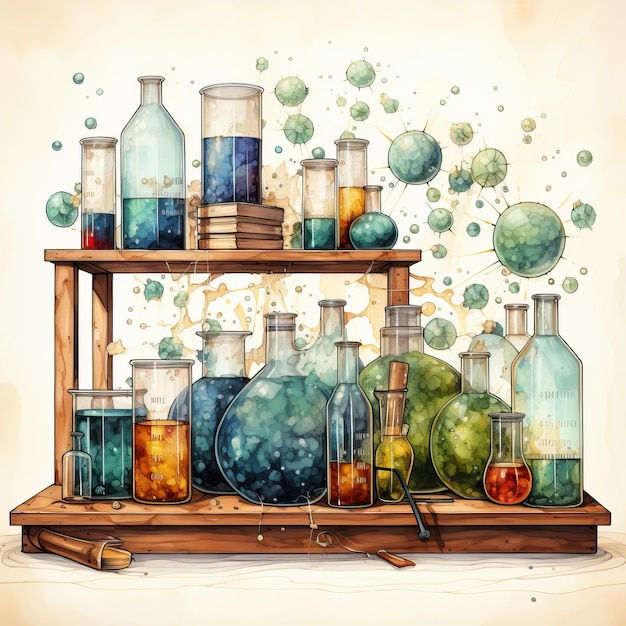
Locate an element on the screen. wooden shelf is located at coordinates (144, 525).